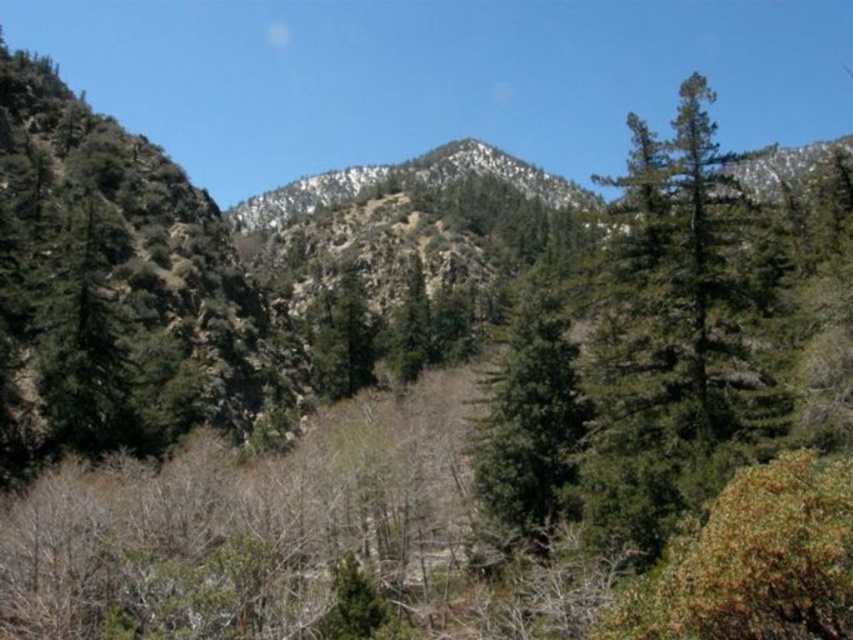
Measure the distance between green needle-like tree at right and green matte tree at center.

A distance of 6.26 meters exists between green needle-like tree at right and green matte tree at center.

Is green needle-like tree at right further to the viewer compared to green matte tree at center?

That is False.

Which is behind, point (688, 417) or point (544, 284)?

The point (544, 284) is behind.

The image size is (853, 640). Find the location of `green needle-like tree at right`. green needle-like tree at right is located at coordinates (672, 337).